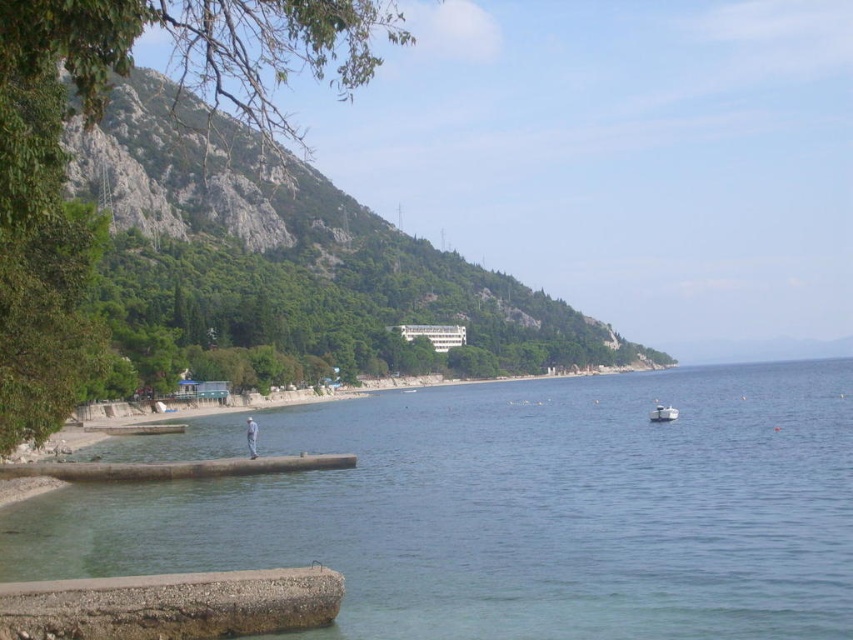
Question: Which point is closer to the camera taking this photo?

Choices:
 (A) (838, 360)
 (B) (245, 420)
 (C) (650, 412)

Answer: (C)

Question: Which object appears farthest from the camera in this image?

Choices:
 (A) clear water at lower left
 (B) light blue denim jeans at lower center
 (C) white plastic boat at lower right
 (D) green leafy hillside at upper left

Answer: (D)

Question: Does green leafy hillside at upper left have a lesser width compared to light blue denim jeans at lower center?

Choices:
 (A) yes
 (B) no

Answer: (B)

Question: Is the position of white plastic boat at lower right more distant than that of light blue denim jeans at lower center?

Choices:
 (A) no
 (B) yes

Answer: (B)

Question: Is green leafy hillside at upper left above white plastic boat at lower right?

Choices:
 (A) yes
 (B) no

Answer: (A)

Question: Which object appears closest to the camera in this image?

Choices:
 (A) green leafy hillside at upper left
 (B) light blue denim jeans at lower center
 (C) clear water at lower left
 (D) white plastic boat at lower right

Answer: (C)